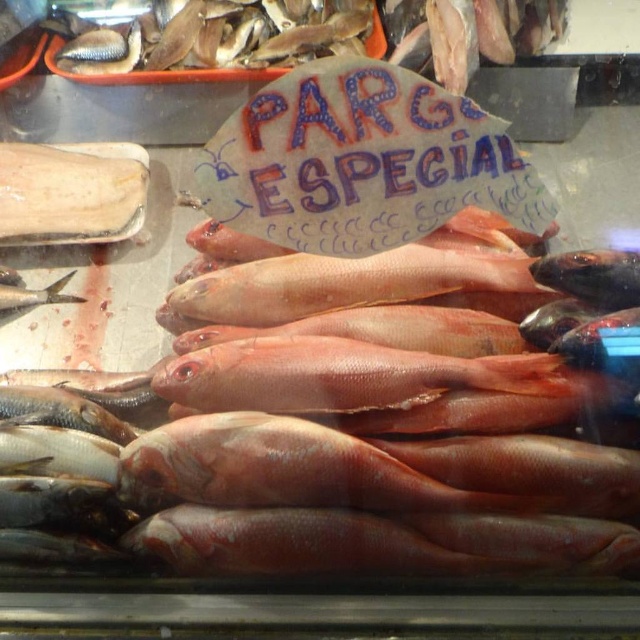
Question: Which of the following is the farthest from the observer?

Choices:
 (A) (131, 202)
 (B) (618, 252)
 (C) (221, 275)

Answer: (A)

Question: Does smooth white bone at upper left have a smaller size compared to shiny silver fish at upper left?

Choices:
 (A) no
 (B) yes

Answer: (B)

Question: Is shiny red fish at center above shiny black fish at center?

Choices:
 (A) yes
 (B) no

Answer: (B)

Question: Is shiny black fish at center below shiny silver fish at center?

Choices:
 (A) yes
 (B) no

Answer: (B)

Question: Which point is farther to the camera?

Choices:
 (A) shiny black fish at center
 (B) smooth white bone at upper left
 (C) shiny red fish at center
 (D) shiny silver fish at upper left

Answer: (D)

Question: Based on their relative distances, which object is nearer to the shiny red fish at center?

Choices:
 (A) shiny black fish at center
 (B) smooth white bone at upper left
 (C) shiny silver fish at center
 (D) shiny silver fish at upper left

Answer: (A)